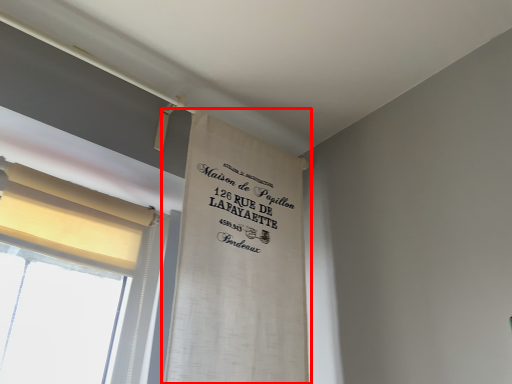
Question: From the image's perspective, what is the correct spatial relationship of curtain (annotated by the red box) in relation to curtain?

Choices:
 (A) above
 (B) below

Answer: (B)